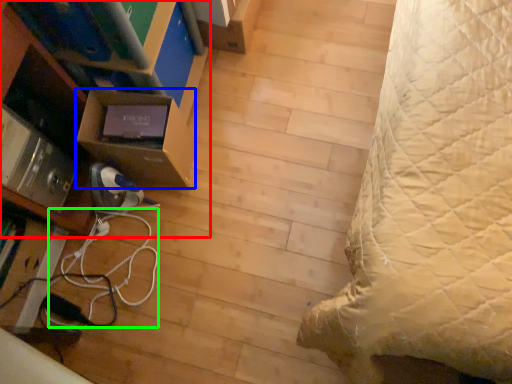
Question: Estimate the real-world distances between objects in this image. Which object is closer to furniture (highlighted by a red box), shelf (highlighted by a blue box) or cable (highlighted by a green box)?

Choices:
 (A) shelf
 (B) cable

Answer: (A)